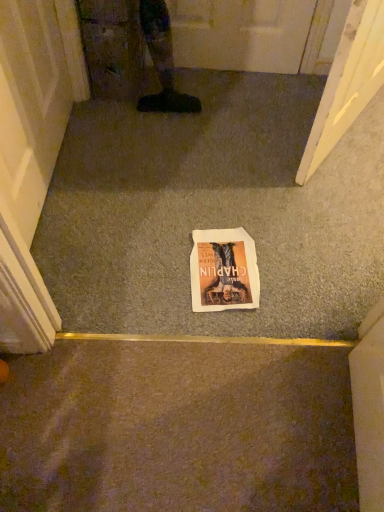
You are a GUI agent. You are given a task and a screenshot of the screen. Output one action in this format:
    pyautogui.click(x=<x>, y=<y>)
    Task: Click on the free point in front of white paper comic book at center
    The height and width of the screenshot is (512, 384).
    Given the screenshot: What is the action you would take?
    pyautogui.click(x=211, y=322)